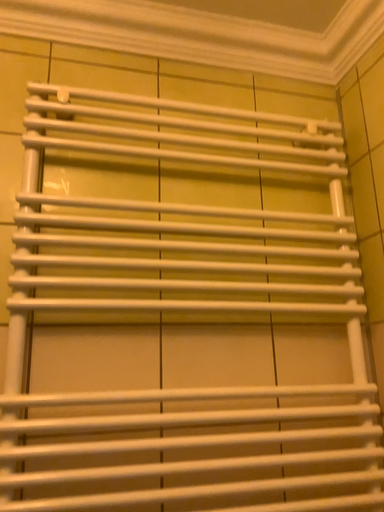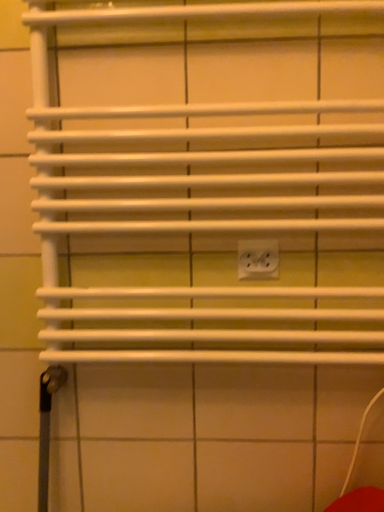
Question: How did the camera likely rotate when shooting the video?

Choices:
 (A) rotated left
 (B) rotated right

Answer: (A)